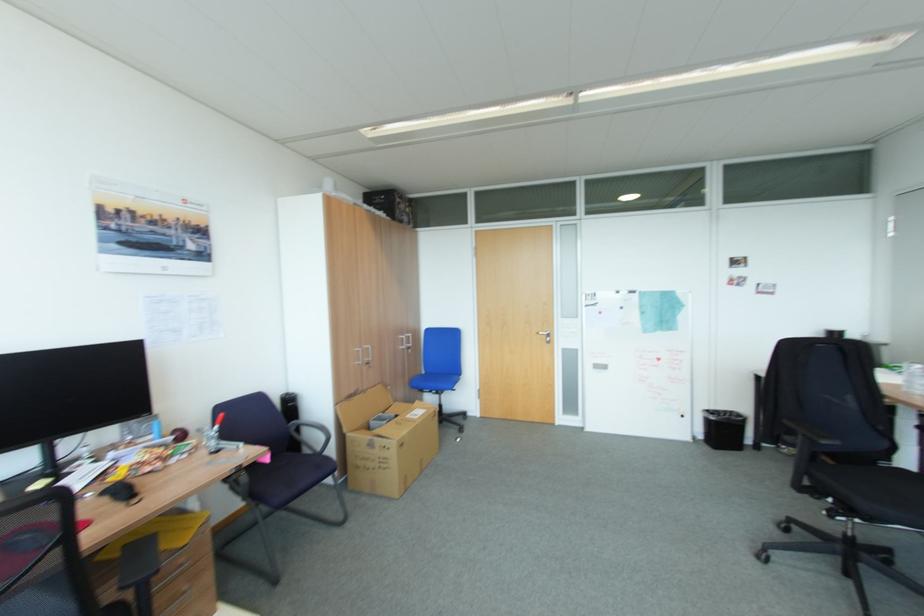
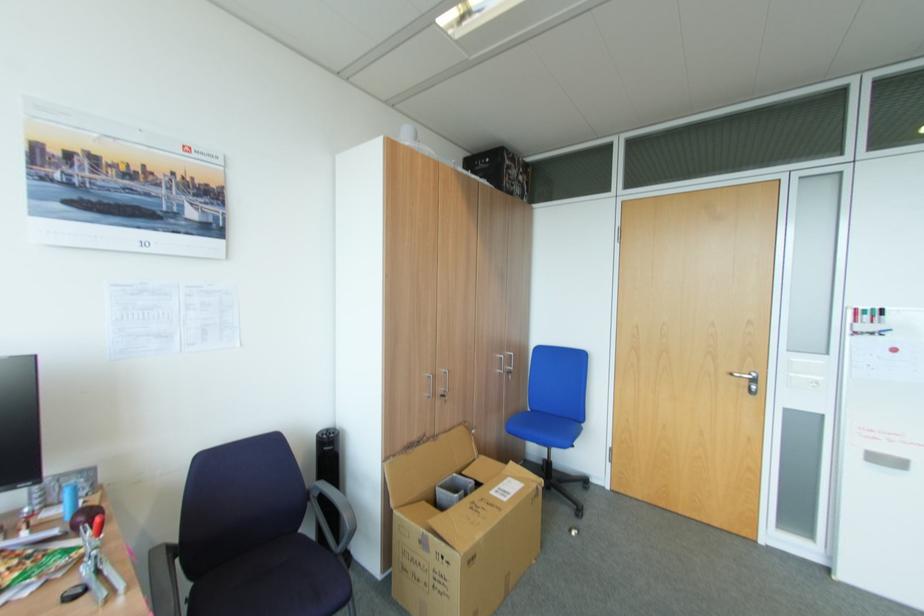
Find the pixel in the second image that matches pixel 551 336 in the first image.

(751, 381)